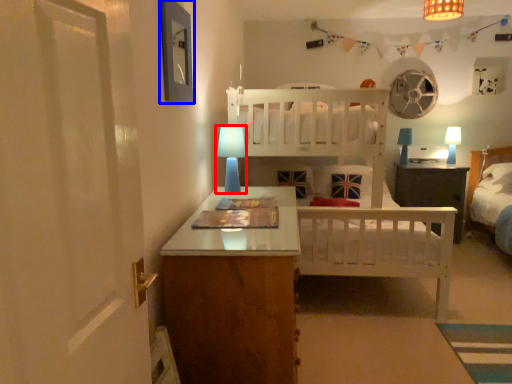
Question: Among these objects, which one is farthest to the camera, table lamp (highlighted by a red box) or picture frame (highlighted by a blue box)?

Choices:
 (A) table lamp
 (B) picture frame

Answer: (A)